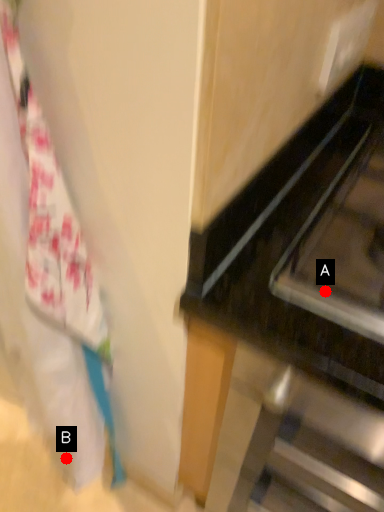
Question: Two points are circled on the image, labeled by A and B beside each circle. Which point is closer to the camera taking this photo?

Choices:
 (A) A is closer
 (B) B is closer

Answer: (A)